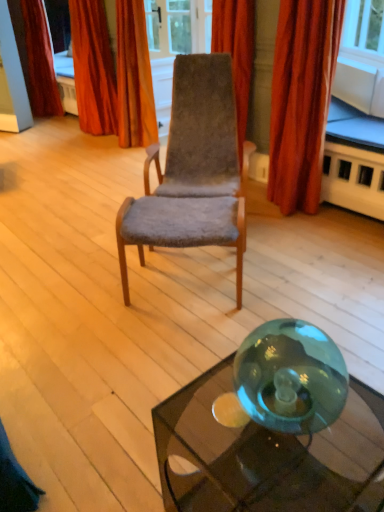
I want to click on vacant area located to the right-hand side of velvet brown chair at center, so click(x=304, y=239).